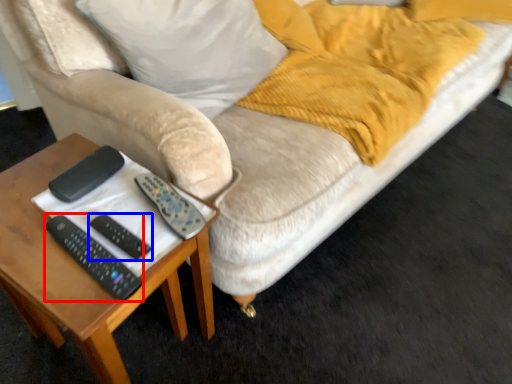
Question: Which point is closer to the camera, remote (highlighted by a red box) or remote (highlighted by a blue box)?

Choices:
 (A) remote
 (B) remote

Answer: (A)